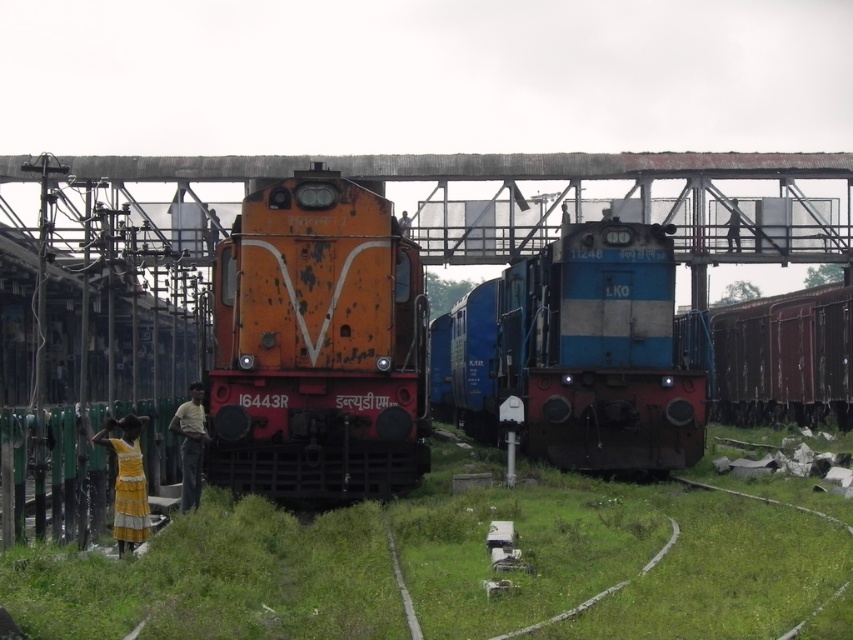
You are a photographer standing at the railway station and want to capture both the yellow cotton dress at lower left and the light brown fabric shirt at lower left in your shot. Which of the two items should you focus on first if you want to include both in the frame without zooming in?

The yellow cotton dress at lower left has a lesser width compared to the light brown fabric shirt at lower left, so you should focus on the light brown fabric shirt at lower left first to ensure it fits within the frame.

You are standing at the point with coordinates point (126, 481) in the railway scene. What object is located at this point?

The point (126, 481) corresponds to the yellow cotton dress at lower left.

You are a pedestrian standing on the overpass looking down. You see the rusty metal train at center and the blue metallic train at center. Which train is positioned higher in elevation?

The rusty metal train at center is above the blue metallic train at center, so it is positioned higher in elevation.